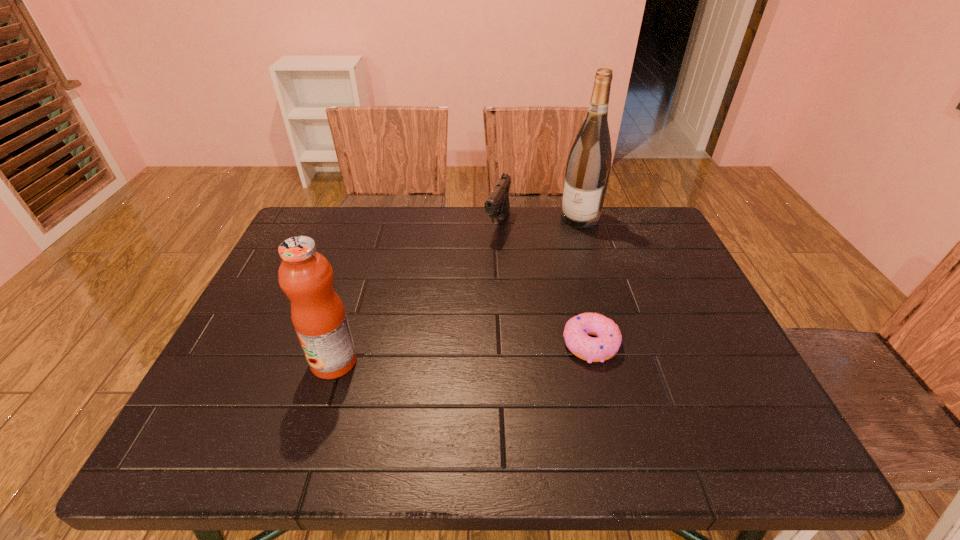
Identify the location of the third shortest object. The width and height of the screenshot is (960, 540). (318, 315).

Where is `fruit juice`? The image size is (960, 540). fruit juice is located at coordinates (318, 315).

You are a GUI agent. You are given a task and a screenshot of the screen. Output one action in this format:
    pyautogui.click(x=<x>, y=<y>)
    Task: Click on the shortest object
    The width and height of the screenshot is (960, 540).
    Given the screenshot: What is the action you would take?
    pyautogui.click(x=606, y=345)

You are a GUI agent. You are given a task and a screenshot of the screen. Output one action in this format:
    pyautogui.click(x=<x>, y=<y>)
    Task: Click on the second object from left to right
    
    Given the screenshot: What is the action you would take?
    pyautogui.click(x=497, y=205)

At what (x,y) coordinates should I click in order to perform the action: click on pistol. Please return your answer as a coordinate pair (x, y). Image resolution: width=960 pixels, height=540 pixels. Looking at the image, I should click on (497, 205).

Where is `wine bottle`? The width and height of the screenshot is (960, 540). wine bottle is located at coordinates (588, 168).

This screenshot has height=540, width=960. I want to click on vacant space located 0.120m on the front label of the third shortest object, so click(x=257, y=361).

I want to click on free region located 0.160m on the front label of the third shortest object, so click(x=239, y=361).

What are the coordinates of `free space located 0.120m on the front label of the third shortest object` in the screenshot? It's located at (257, 361).

Image resolution: width=960 pixels, height=540 pixels. I want to click on free space located on the right of the doughnut, so click(693, 343).